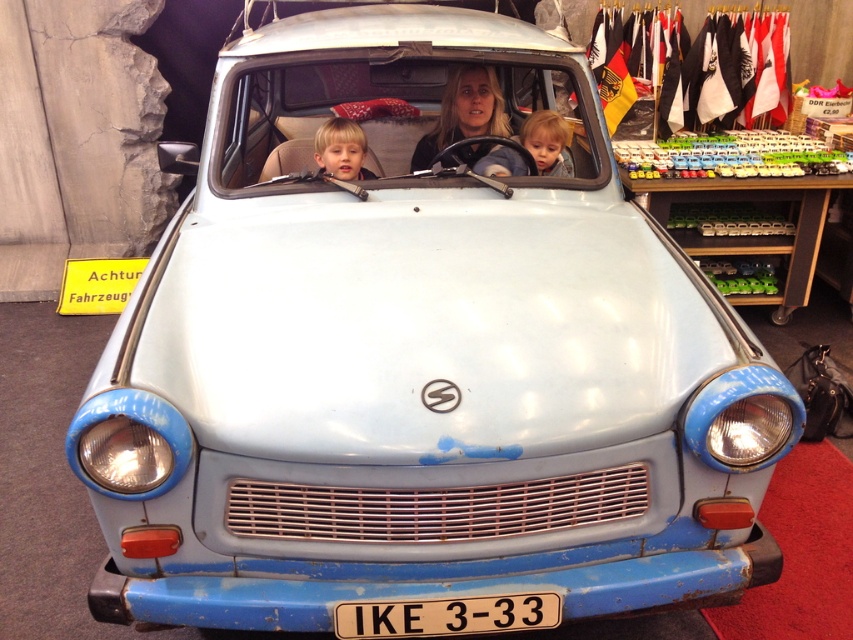
Question: Considering the real-world distances, which object is farthest from the white plastic license plate at center?

Choices:
 (A) blonde hair boy at center
 (B) matte black hair at center
 (C) smooth skin child at center

Answer: (B)

Question: Which of the following is the farthest from the observer?

Choices:
 (A) (326, 160)
 (B) (490, 134)
 (C) (416, 621)
 (D) (494, 156)

Answer: (B)

Question: Estimate the real-world distances between objects in this image. Which object is farther from the smooth skin child at center?

Choices:
 (A) matte black hair at center
 (B) blonde hair boy at center

Answer: (B)

Question: Is matte black hair at center above smooth skin child at center?

Choices:
 (A) yes
 (B) no

Answer: (A)

Question: Is white plastic license plate at center in front of blonde hair boy at center?

Choices:
 (A) no
 (B) yes

Answer: (B)

Question: In this image, where is white plastic license plate at center located relative to matte black hair at center?

Choices:
 (A) left
 (B) right

Answer: (A)